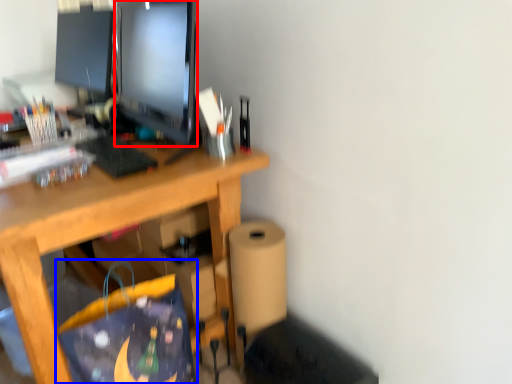
Question: Which object is further to the camera taking this photo, television (highlighted by a red box) or shopping bag (highlighted by a blue box)?

Choices:
 (A) television
 (B) shopping bag

Answer: (A)